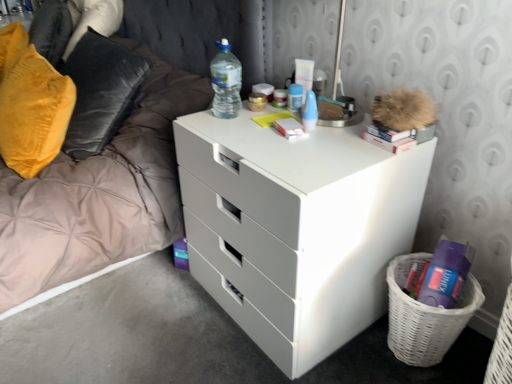
The width and height of the screenshot is (512, 384). I want to click on vacant space that is to the left of hardcover book at upper right, arranged as the second book when viewed from the left, so click(322, 150).